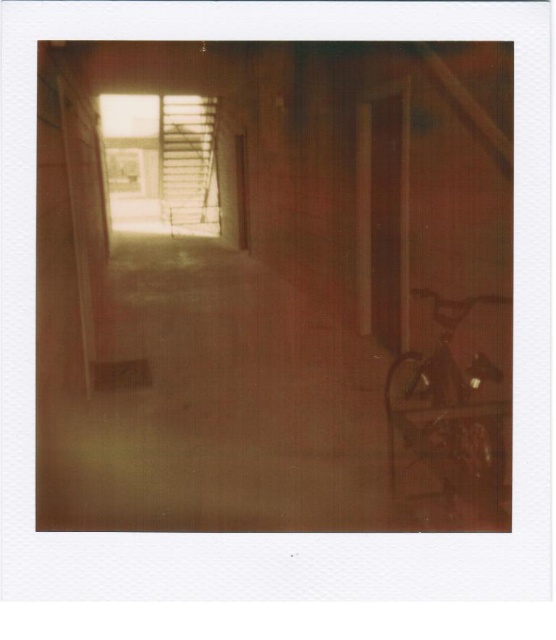
Question: Does matte concrete corridor at center appear under wooden rocking chair at right?

Choices:
 (A) yes
 (B) no

Answer: (B)

Question: Which point appears farthest from the camera in this image?

Choices:
 (A) (425, 497)
 (B) (431, 364)

Answer: (B)

Question: Which of the following is the farthest from the observer?

Choices:
 (A) matte concrete corridor at center
 (B) wooden rocking chair at right

Answer: (A)

Question: Is the position of matte concrete corridor at center more distant than that of wooden rocking chair at right?

Choices:
 (A) no
 (B) yes

Answer: (B)

Question: Can you confirm if matte concrete corridor at center is positioned below wooden rocking chair at right?

Choices:
 (A) yes
 (B) no

Answer: (B)